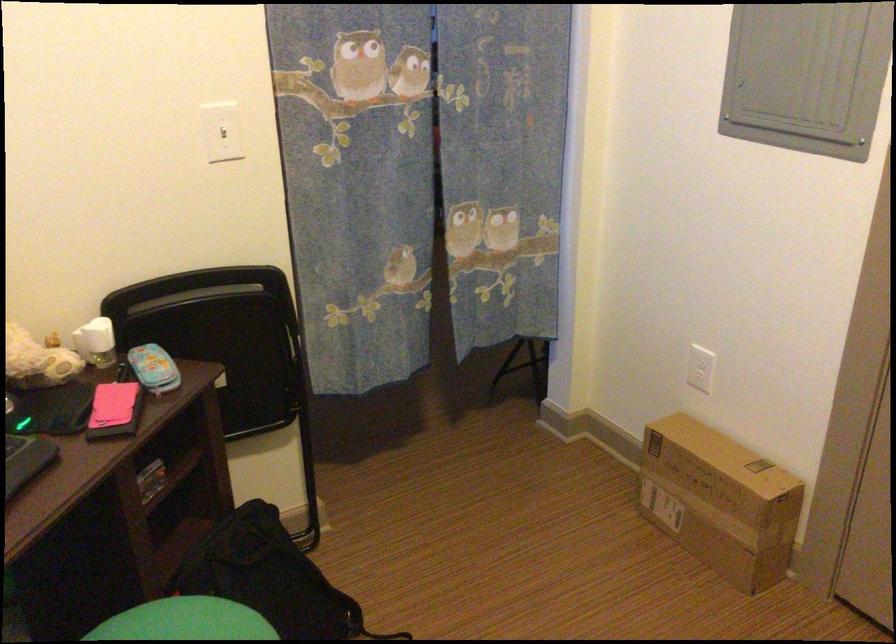
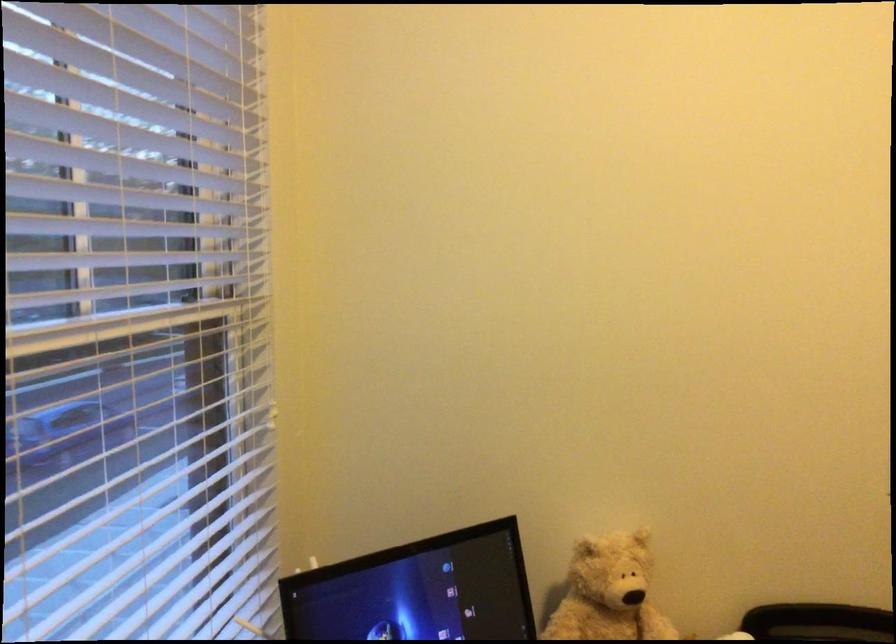
Question: Based on the continuous images, in which direction is the camera rotating? Reply with the corresponding letter.

Choices:
 (A) Left
 (B) Right
 (C) Up
 (D) Down

Answer: (A)